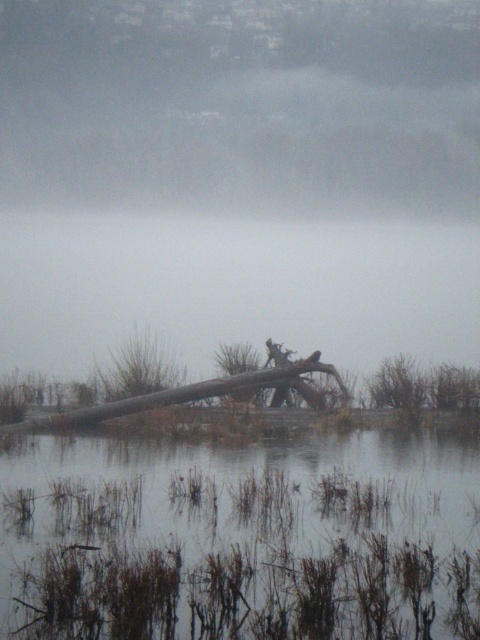
Question: Which object is farther from the camera taking this photo?

Choices:
 (A) transparent water at center
 (B) brown grassy water at lower center

Answer: (A)

Question: Is brown grassy water at lower center positioned behind foggy mist at upper center?

Choices:
 (A) no
 (B) yes

Answer: (A)

Question: Which of the following is the farthest from the observer?

Choices:
 (A) (283, 528)
 (B) (172, 64)

Answer: (B)

Question: Does foggy mist at upper center have a smaller size compared to transparent water at center?

Choices:
 (A) no
 (B) yes

Answer: (B)

Question: Which of the following is the closest to the observer?

Choices:
 (A) (251, 195)
 (B) (350, 272)
 (C) (123, 525)

Answer: (C)

Question: Is foggy mist at upper center below transparent water at center?

Choices:
 (A) no
 (B) yes

Answer: (A)